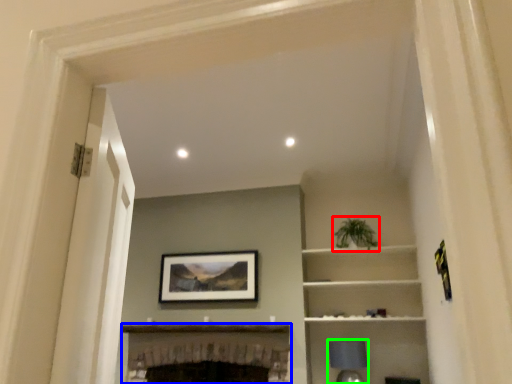
Question: Which object is the farthest from plant (highlighted by a red box)? Choose among these: fireplace (highlighted by a blue box) or lamp (highlighted by a green box).

Choices:
 (A) fireplace
 (B) lamp

Answer: (A)